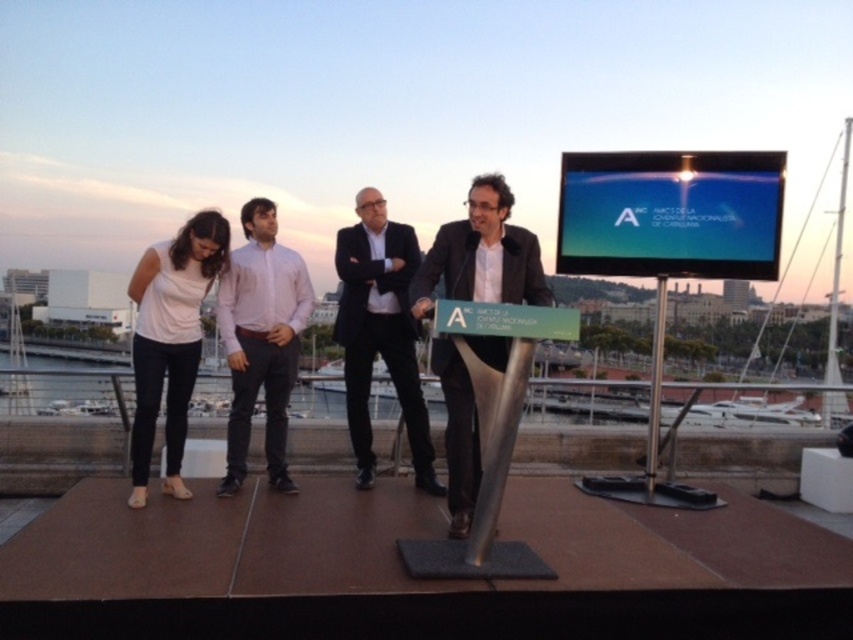
You are a photographer setting up a tripod in front of the stage. You want to frame both the pink cotton shirt at center and the dark gray suit at center in your shot. Which of the two should you focus on first to ensure they are both in focus?

The pink cotton shirt at center is much taller than the dark gray suit at center, so you should focus on the pink cotton shirt at center first to ensure both are in focus.